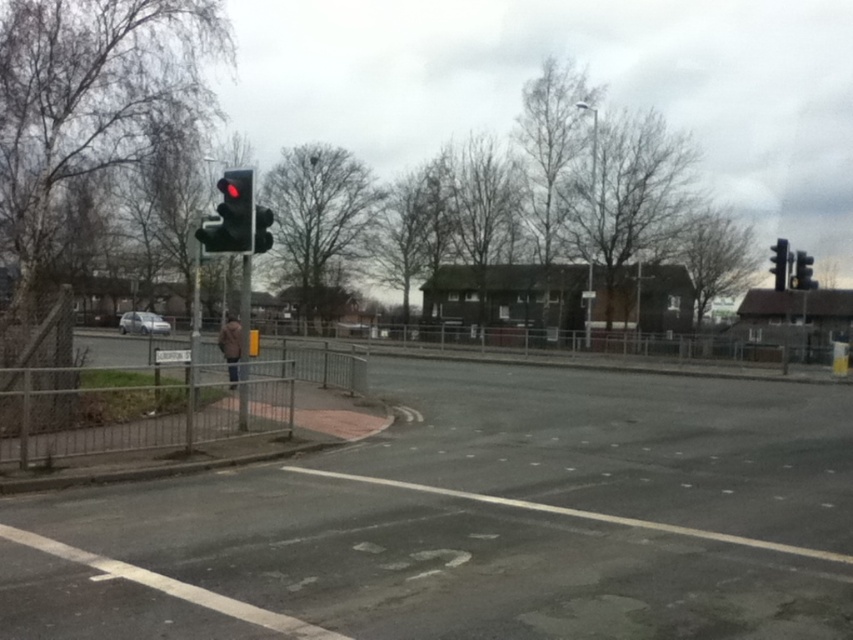
You are a pedestrian waiting at the sidewalk. You need to cross the street but must ensure there is enough space between the silver metallic car at lower left and the metallic traffic light at right to safely pass through. Can you determine if the space between them is wide enough for a standard wheelchair? The standard wheelchair requires at least 90 cm of width to maneuver safely.

The silver metallic car at lower left has a lesser width compared to the metallic traffic light at right, but the exact distance between them isn generated in the objects description. Therefore, it is impossible to determine if the space is wide enough for a standard wheelchair based on the provided information.

You are a pedestrian waiting at the sidewalk. You see the matte black traffic light at upper left and the silver metallic car at lower left. Which object takes up more space in the image?

The silver metallic car at lower left takes up more space in the image than the matte black traffic light at upper left because the matte black traffic light at upper left occupies less space than silver metallic car at lower left.